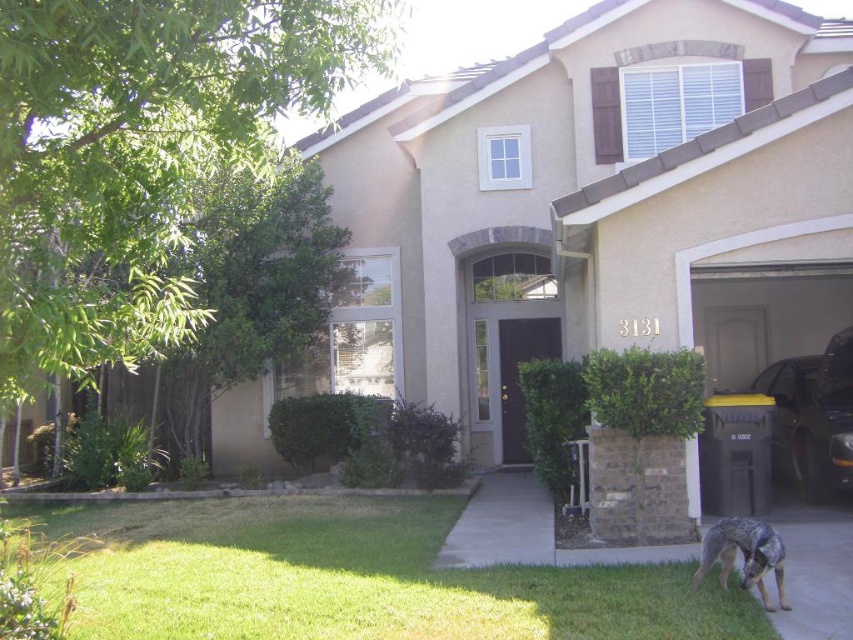
You are driving a car that is 2 meters wide. You want to park on the gray concrete driveway at center. Is there enough space for your car to fit on the driveway?

The gray concrete driveway at center is located at point (502, 524). However, the description does not provide information about the driveway width or dimensions. Therefore, it is impossible to determine if the car will fit based on the given information.

You are a delivery person arriving at the house to drop off a package. You see the metallic dark gray car at right and the green leafy bush at center. Which object is closer to you as you approach the house?

The metallic dark gray car at right is closer to you because it is in front of the green leafy bush at center.